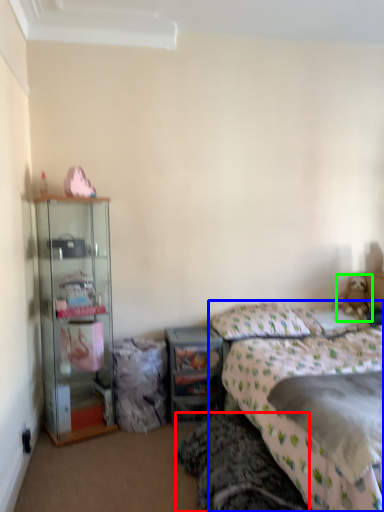
Question: Which object is positioned closest to bed frame (highlighted by a red box)? Select from bed (highlighted by a blue box) and teddy bear (highlighted by a green box).

Choices:
 (A) bed
 (B) teddy bear

Answer: (A)